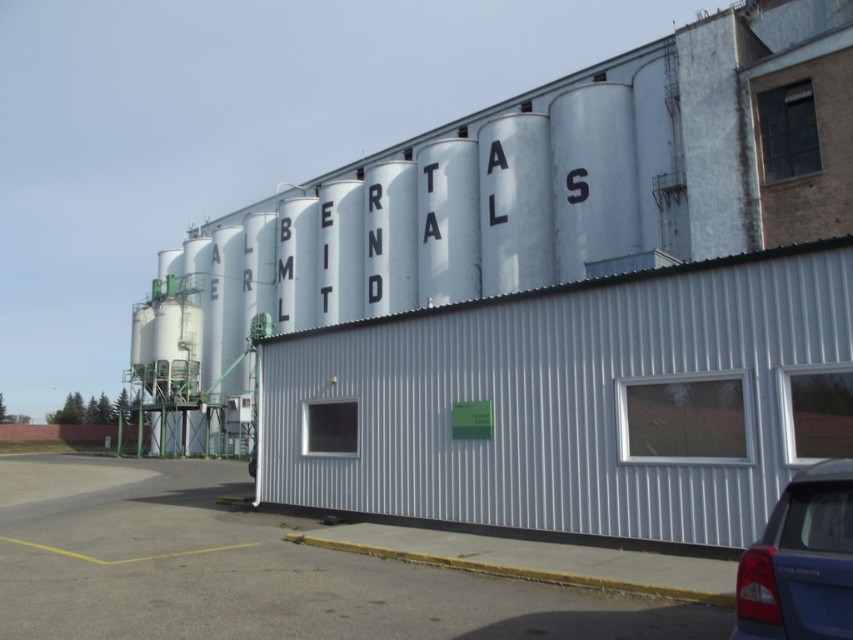
You are a delivery driver approaching the Alberta Ltd facility. You need to park your vehicle, the blue matte sedan at lower right, near the gray asphalt at lower left. Can you drive directly from your current position to the parking spot without moving around any obstacles?

The gray asphalt at lower left is to the left of blue matte sedan at lower right. Since the gray asphalt at lower left is positioned to the left of the blue matte sedan at lower right, you can drive directly to the parking spot without needing to maneuver around obstacles.

You are standing at the point labeled as point (254,570) in the industrial area. What type of surface are you currently standing on?

You are standing on gray asphalt at lower left.